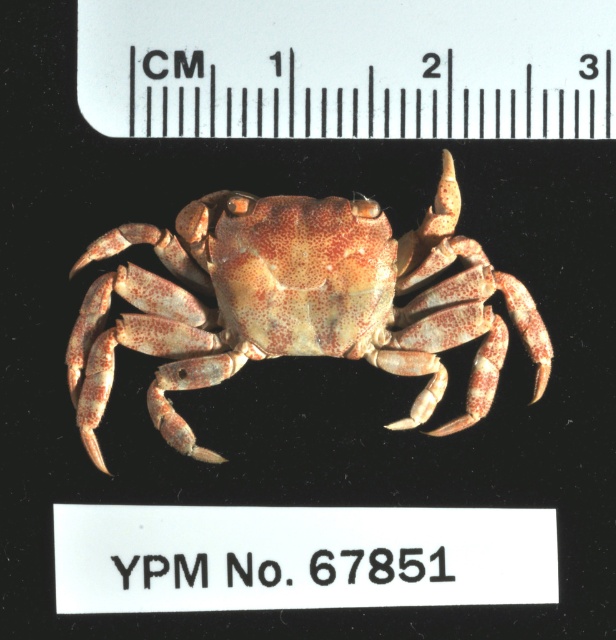
You are a marine biologist examining the image of a crab. You need to measure the crab using the ruler shown. However, the ruler is positioned above the crab. Can you determine if the distance between the white plastic ruler at upper center and the speckled beige crab at center is less than 10 inches?

The white plastic ruler at upper center and the speckled beige crab at center are 9.32 inches apart, which is less than 10 inches. Therefore, the distance between them is less than 10 inches.

Consider the image. You are an entomologist examining a crab image. The crab is placed against a black background with a white ruler above it. You need to determine the position of the ruler relative to the crab. Which object in the image corresponds to the point coordinates given as point (347, 68)?

The white plastic ruler at upper center corresponds to the point coordinates point (347, 68).

You are an entomologist examining the crab image. The crab has a ruler above it. Where is the white plastic ruler at upper center located in terms of coordinates?

The white plastic ruler at upper center is located at coordinates point (347, 68).